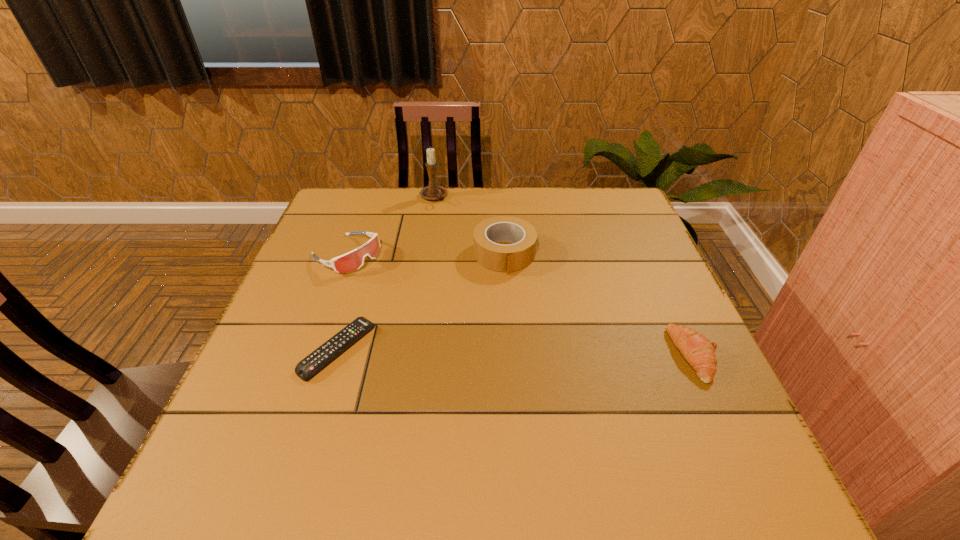
You are a GUI agent. You are given a task and a screenshot of the screen. Output one action in this format:
    pyautogui.click(x=<x>, y=<y>)
    Task: Click on the goggles at the left edge
    This screenshot has width=960, height=540.
    Given the screenshot: What is the action you would take?
    pyautogui.click(x=353, y=260)

Locate an element on the screen. The image size is (960, 540). object located at the right edge is located at coordinates (699, 352).

Where is `vacant space at the far edge of the desktop`? vacant space at the far edge of the desktop is located at coordinates (466, 201).

This screenshot has height=540, width=960. I want to click on vacant space at the near edge of the desktop, so click(x=610, y=422).

Where is `blank space at the left edge`? The image size is (960, 540). blank space at the left edge is located at coordinates (310, 279).

This screenshot has width=960, height=540. I want to click on vacant space at the right edge, so click(x=615, y=255).

Where is `blank space at the far right corner`? This screenshot has width=960, height=540. blank space at the far right corner is located at coordinates (595, 199).

You are a GUI agent. You are given a task and a screenshot of the screen. Output one action in this format:
    pyautogui.click(x=<x>, y=<y>)
    Task: Click on the blank region between the third object from left to right and the goggles
    This screenshot has height=540, width=960.
    Given the screenshot: What is the action you would take?
    pyautogui.click(x=390, y=226)

I want to click on vacant region between the rightmost object and the candle holder, so click(x=564, y=276).

Identify the location of empty space between the farthest object and the crescent roll. The width and height of the screenshot is (960, 540). (564, 276).